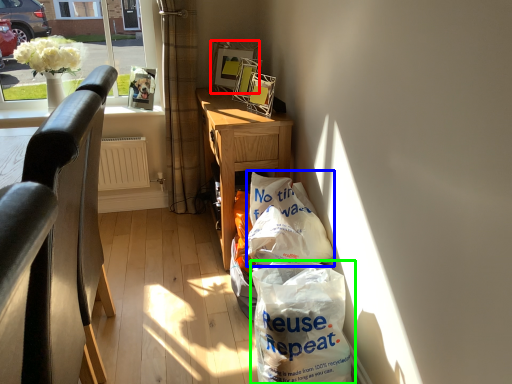
Question: Which object is the farthest from picture frame (highlighted by a red box)? Choose among these: grocery bag (highlighted by a blue box) or plastic bag (highlighted by a green box).

Choices:
 (A) grocery bag
 (B) plastic bag

Answer: (B)